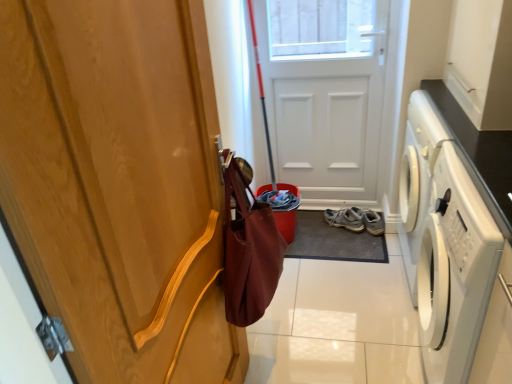
In order to click on blank space above white glossy tile at lower center (from a real-world perspective) in this screenshot , I will do `click(344, 268)`.